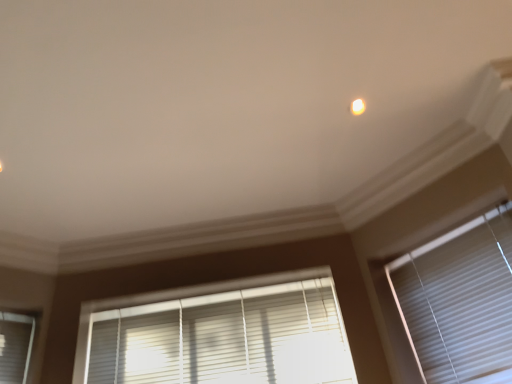
Question: Is white matte window blind at right, which appears as the 1th window blind when viewed from the right, at the back of white glossy light at upper center?

Choices:
 (A) yes
 (B) no

Answer: (B)

Question: From the image's perspective, does white glossy light at upper center appear lower than white matte window blind at right, which appears as the 1th window blind when viewed from the right?

Choices:
 (A) no
 (B) yes

Answer: (A)

Question: Is white glossy light at upper center not within white matte window blind at right, which appears as the 1th window blind when viewed from the right?

Choices:
 (A) yes
 (B) no

Answer: (A)

Question: Are white glossy light at upper center and white matte window blind at right, acting as the second window blind starting from the left, far apart?

Choices:
 (A) yes
 (B) no

Answer: (B)

Question: Would you say white glossy light at upper center contains white matte window blind at right, acting as the second window blind starting from the left?

Choices:
 (A) no
 (B) yes

Answer: (A)

Question: In terms of height, does white glossy light at upper center look taller or shorter compared to white plastic blinds at lower center, which appears as the second window blind when viewed from the right?

Choices:
 (A) short
 (B) tall

Answer: (A)

Question: Choose the correct answer: Is white glossy light at upper center inside white plastic blinds at lower center, which appears as the second window blind when viewed from the right, or outside it?

Choices:
 (A) outside
 (B) inside

Answer: (A)

Question: From a real-world perspective, relative to white plastic blinds at lower center, which appears as the second window blind when viewed from the right, is white glossy light at upper center vertically above or below?

Choices:
 (A) below
 (B) above

Answer: (B)

Question: Relative to white plastic blinds at lower center, the 1th window blind positioned from the left, is white glossy light at upper center in front or behind?

Choices:
 (A) behind
 (B) front

Answer: (B)

Question: In the image, is white matte window blind at right, which appears as the 1th window blind when viewed from the right, on the left side or the right side of white glossy light at upper center?

Choices:
 (A) left
 (B) right

Answer: (B)

Question: From a real-world perspective, relative to white glossy light at upper center, is white matte window blind at right, which appears as the 1th window blind when viewed from the right, vertically above or below?

Choices:
 (A) above
 (B) below

Answer: (B)

Question: In terms of height, does white matte window blind at right, acting as the second window blind starting from the left, look taller or shorter compared to white glossy light at upper center?

Choices:
 (A) short
 (B) tall

Answer: (B)

Question: Looking at the image, does white matte window blind at right, acting as the second window blind starting from the left, seem bigger or smaller compared to white glossy light at upper center?

Choices:
 (A) big
 (B) small

Answer: (A)

Question: Is white glossy light at upper center bigger or smaller than white matte window blind at right, acting as the second window blind starting from the left?

Choices:
 (A) small
 (B) big

Answer: (A)

Question: In the image, is white glossy light at upper center on the left side or the right side of white matte window blind at right, acting as the second window blind starting from the left?

Choices:
 (A) right
 (B) left

Answer: (B)